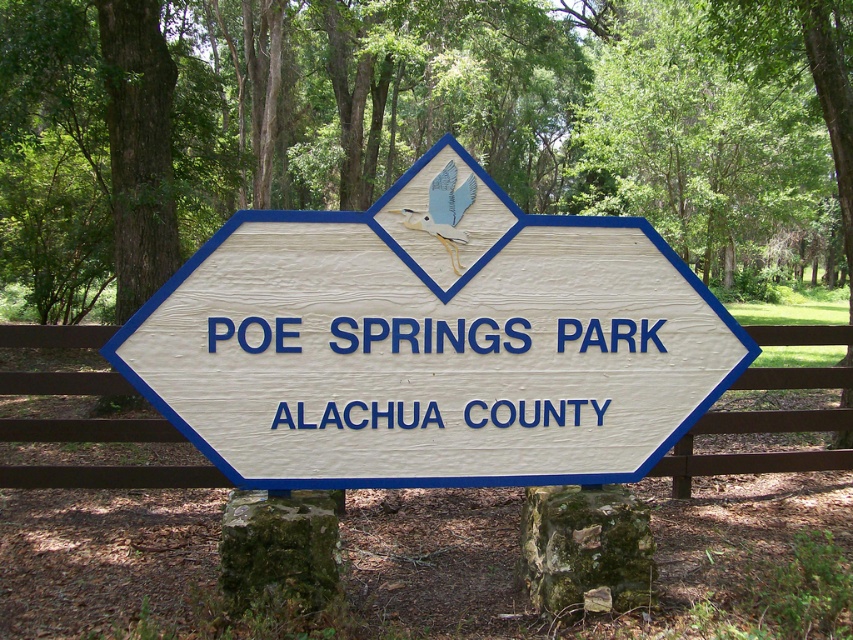
Question: Considering the relative positions of wooden sign at center and brown wooden fence at center in the image provided, where is wooden sign at center located with respect to brown wooden fence at center?

Choices:
 (A) below
 (B) above

Answer: (B)

Question: Can you confirm if wooden sign at center is smaller than brown wooden fence at center?

Choices:
 (A) no
 (B) yes

Answer: (A)

Question: From the image, what is the correct spatial relationship of wooden sign at center in relation to brown wooden fence at center?

Choices:
 (A) above
 (B) below

Answer: (A)